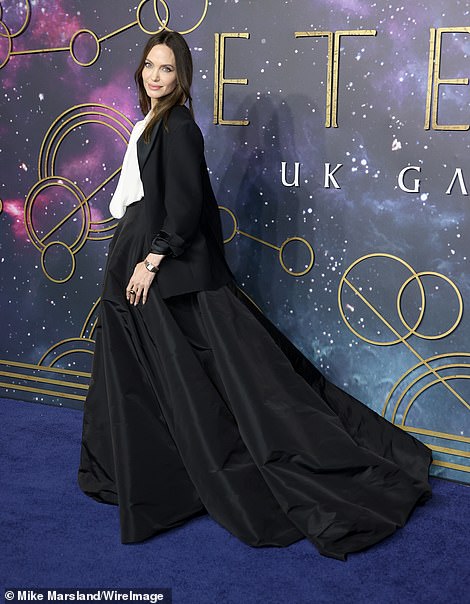
Locate an element on the screen. carpet is located at coordinates (307, 583).